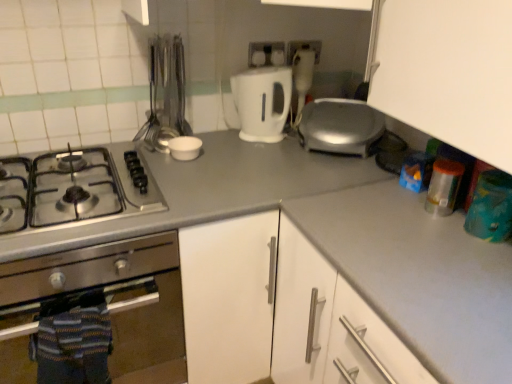
Identify the location of free spot to the right of white matte bowl at center. (231, 155).